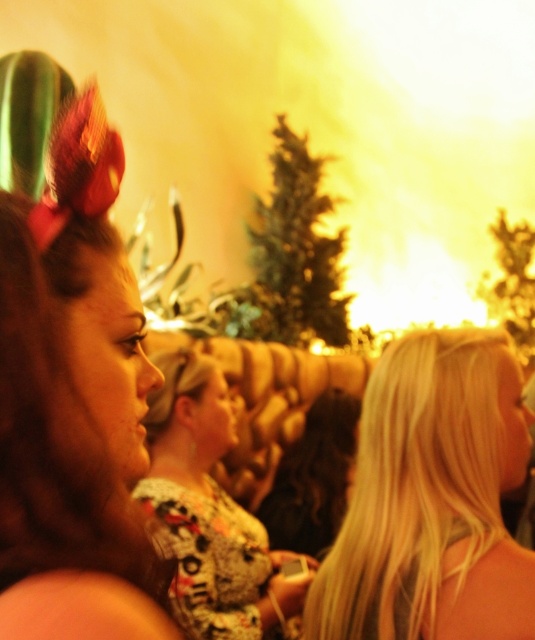
Question: Which of the following is the farthest from the observer?

Choices:
 (A) dark curly hair at center
 (B) blonde hair at right

Answer: (A)

Question: Does floral-patterned shirt at center have a lesser width compared to blonde hair at center?

Choices:
 (A) yes
 (B) no

Answer: (B)

Question: Considering the real-world distances, which object is farthest from the blonde hair at center?

Choices:
 (A) brown shiny hair at left
 (B) floral-patterned shirt at center
 (C) dark curly hair at center
 (D) blonde hair at right

Answer: (A)

Question: Does floral-patterned shirt at center come in front of blonde hair at center?

Choices:
 (A) yes
 (B) no

Answer: (A)

Question: Among these points, which one is farthest from the camera?

Choices:
 (A) click(x=250, y=600)
 (B) click(x=343, y=419)
 (C) click(x=171, y=374)

Answer: (B)

Question: Is brown shiny hair at left in front of floral-patterned shirt at center?

Choices:
 (A) no
 (B) yes

Answer: (B)